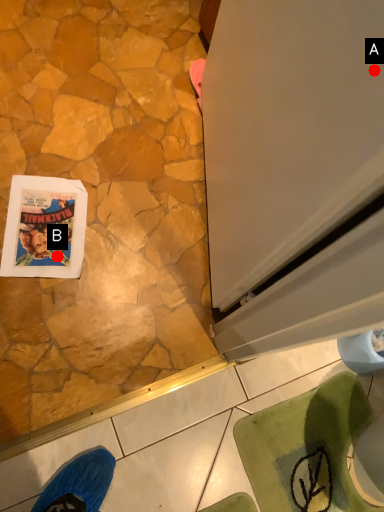
Question: Two points are circled on the image, labeled by A and B beside each circle. Which point is further to the camera?

Choices:
 (A) A is further
 (B) B is further

Answer: (B)